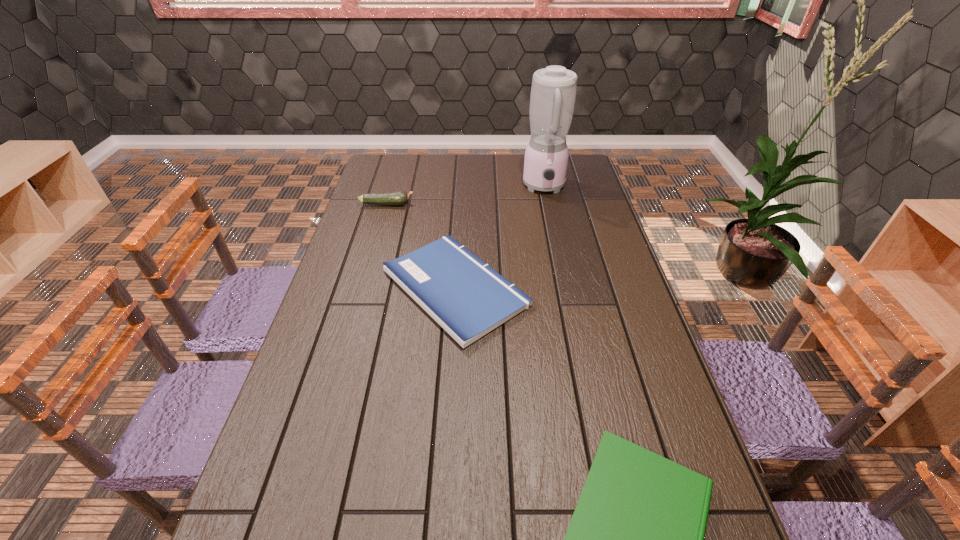
The width and height of the screenshot is (960, 540). Identify the location of free space between the zucchini and the third farthest object. (421, 246).

Locate an element on the screen. This screenshot has height=540, width=960. object that is the third nearest to the second tallest object is located at coordinates coord(636,538).

Choose which object is the third nearest neighbor to the farther paperback book. Please provide its 2D coordinates. Your answer should be formatted as a tuple, i.e. [(x, y)], where the tuple contains the x and y coordinates of a point satisfying the conditions above.

[(636, 538)]

This screenshot has width=960, height=540. I want to click on blank space that satisfies the following two spatial constraints: 1. at the blossom end of the second nearest object; 2. on the right side of the third shortest object, so click(363, 288).

This screenshot has height=540, width=960. Identify the location of vacant region that satisfies the following two spatial constraints: 1. at the blossom end of the second tallest object; 2. on the right side of the farther paperback book. (363, 288).

Locate an element on the screen. The height and width of the screenshot is (540, 960). free space in the image that satisfies the following two spatial constraints: 1. at the blossom end of the second tallest object; 2. on the right side of the second nearest object is located at coordinates (363, 288).